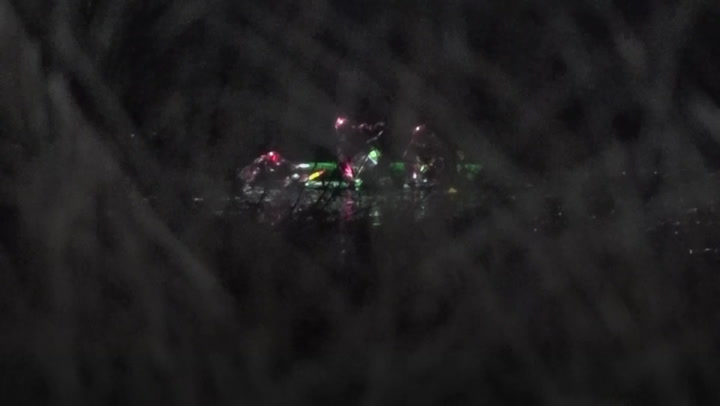
I want to click on green lights, so click(x=323, y=163), click(x=371, y=153), click(x=400, y=169), click(x=476, y=171).